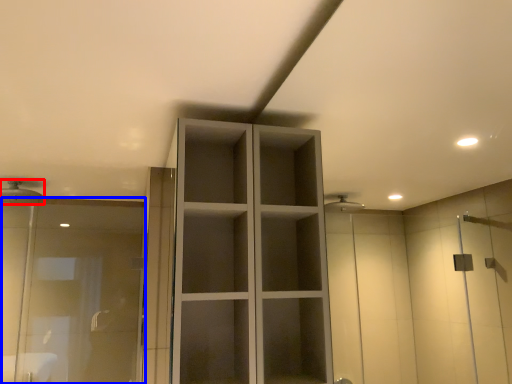
Question: Which point is further to the camera, shower (highlighted by a red box) or screen door (highlighted by a blue box)?

Choices:
 (A) shower
 (B) screen door

Answer: (A)